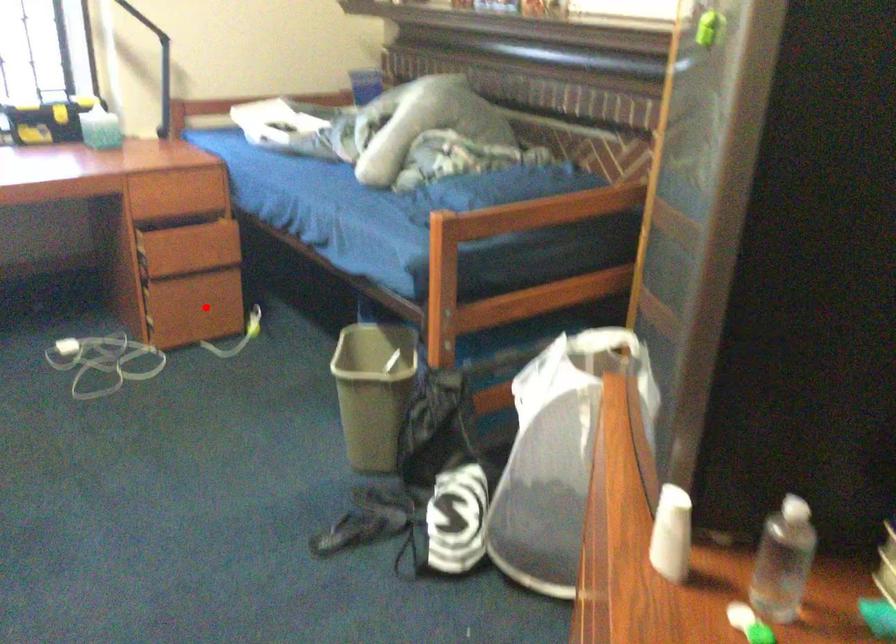
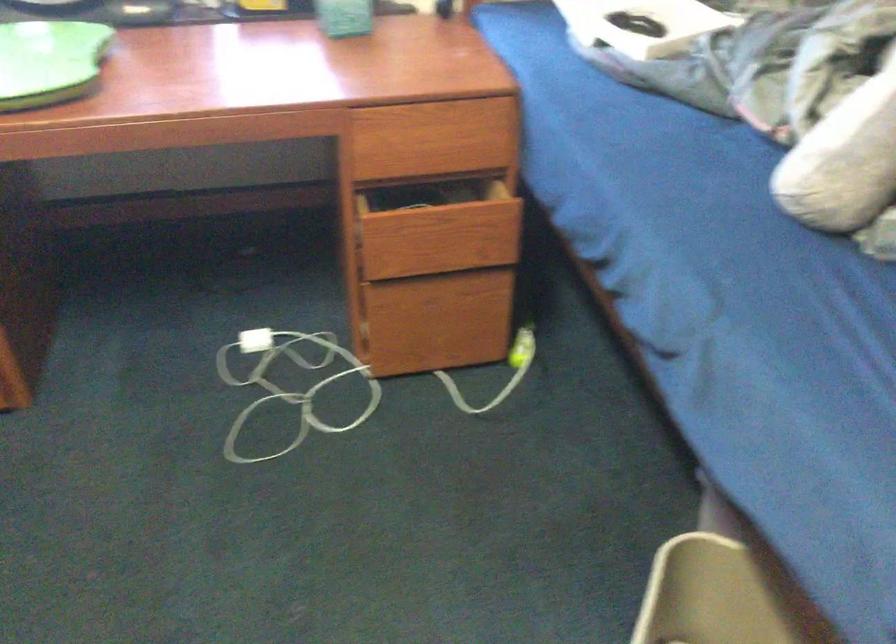
Where in the second image is the point corresponding to the highlighted location from the first image?

(455, 321)